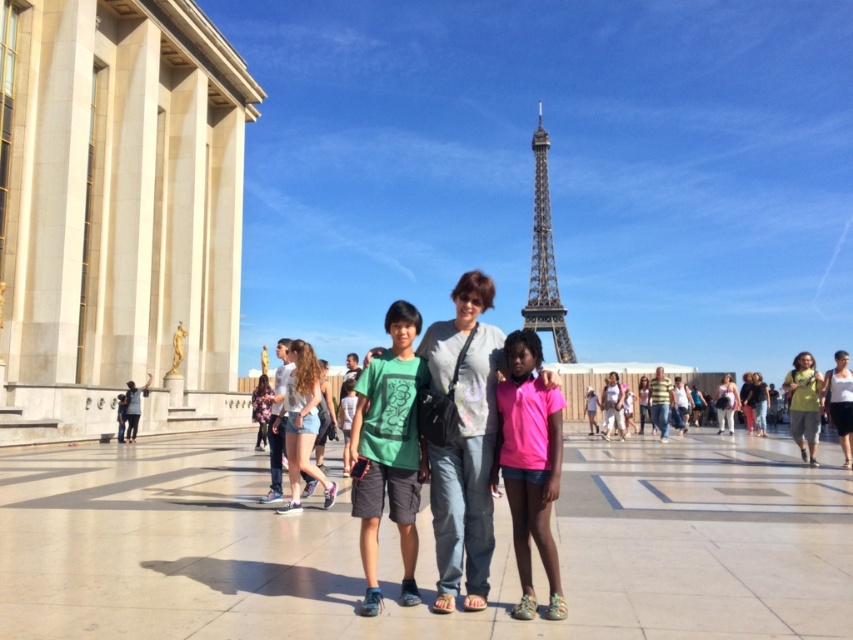
Question: Which is farther from the denim shorts at lower left?

Choices:
 (A) white cotton shirt at center
 (B) light yellow fabric dress at center
 (C) striped cotton shirt at right

Answer: (B)

Question: Does matte green t-shirt at center appear on the left side of denim shorts at lower left?

Choices:
 (A) yes
 (B) no

Answer: (B)

Question: Is denim shorts at lower left to the right of yellow fabric shirt at right from the viewer's perspective?

Choices:
 (A) yes
 (B) no

Answer: (B)

Question: Considering the real-world distances, which object is closest to the white cotton shirt at center?

Choices:
 (A) light blue denim jeans at center
 (B) pink fabric shirt at lower right
 (C) pink matte shirt at center

Answer: (A)

Question: Can you confirm if denim shorts at lower left is thinner than light yellow fabric dress at center?

Choices:
 (A) yes
 (B) no

Answer: (B)

Question: Which is nearer to the yellow fabric shirt at right?

Choices:
 (A) metallic gray eiffel tower at center
 (B) pink fabric shirt at lower right
 (C) denim shorts at lower left

Answer: (B)